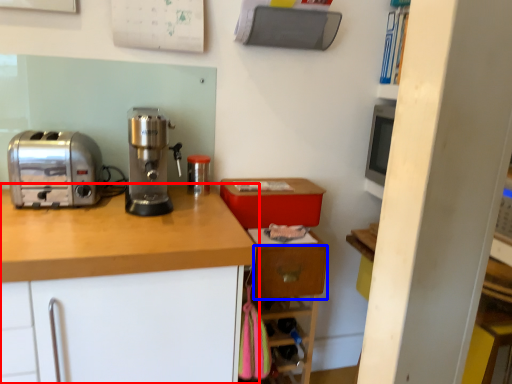
Question: Which object appears farthest to the camera in this image, cabinetry (highlighted by a red box) or drawer (highlighted by a blue box)?

Choices:
 (A) cabinetry
 (B) drawer

Answer: (B)